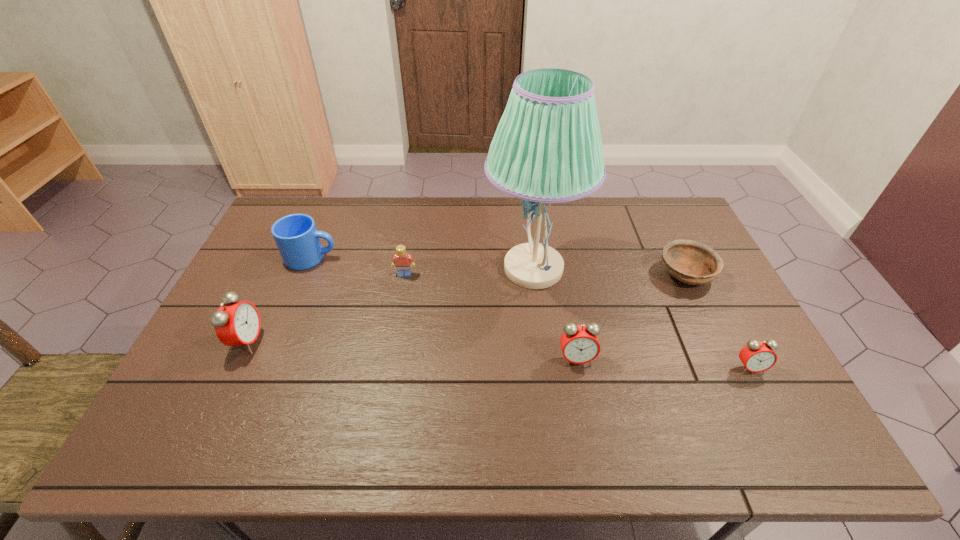
Where is `free space for an extra alarm_clock to achieve even spacing`? free space for an extra alarm_clock to achieve even spacing is located at coordinates (409, 350).